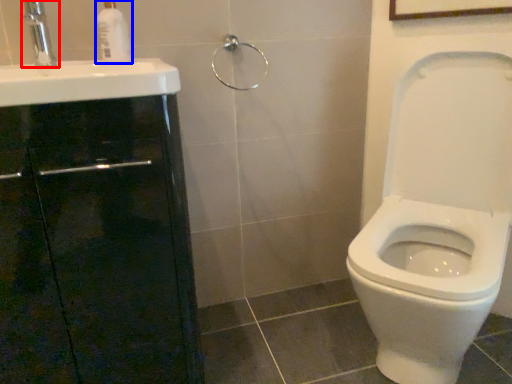
Question: Which object is further to the camera taking this photo, tap (highlighted by a red box) or soap dispenser (highlighted by a blue box)?

Choices:
 (A) tap
 (B) soap dispenser

Answer: (B)